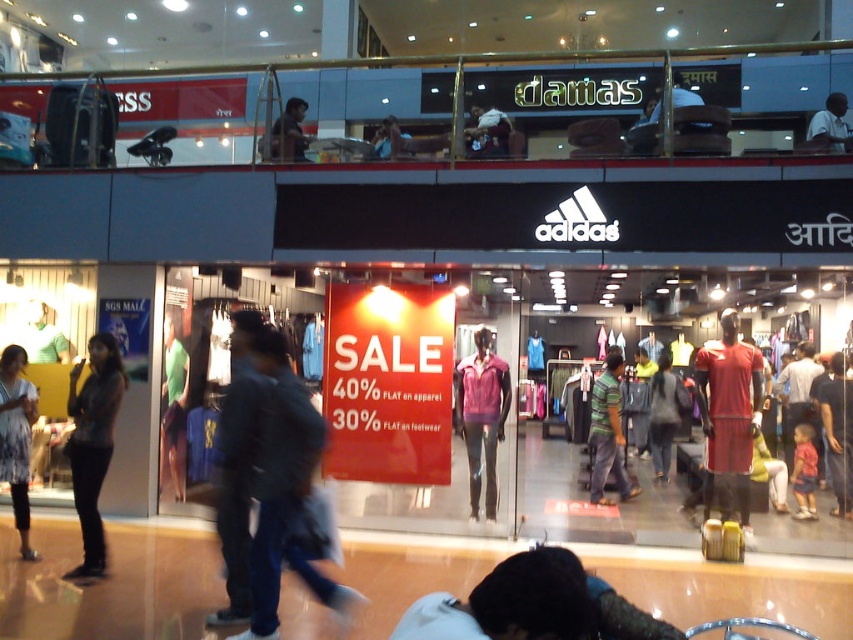
Between point (294, 467) and point (273, 124), which one is positioned behind?

The point (273, 124) is more distant.

Between point (254, 563) and point (306, 106), which one is positioned behind?

The point (306, 106) is behind.

You are a GUI agent. You are given a task and a screenshot of the screen. Output one action in this format:
    pyautogui.click(x=<x>, y=<y>)
    Task: Click on the denim jacket at center
    The width and height of the screenshot is (853, 640).
    Given the screenshot: What is the action you would take?
    pyautogui.click(x=287, y=492)

Can you confirm if pink fabric jacket at center is wider than matte black shirt at upper center?

Yes.

Between point (488, 436) and point (300, 129), which one is positioned in front?

Positioned in front is point (488, 436).

Is point (486, 355) closer to camera compared to point (305, 147)?

Yes, point (486, 355) is closer to viewer.

Locate an element on the screen. pink fabric jacket at center is located at coordinates (482, 417).

Which is more to the left, striped cotton shirt at center or matte black shirt at upper center?

From the viewer's perspective, matte black shirt at upper center appears more on the left side.

Between striped cotton shirt at center and matte black shirt at upper center, which one appears on the right side from the viewer's perspective?

striped cotton shirt at center

Who is more forward, (593, 499) or (294, 129)?

Point (294, 129) is in front.

Locate an element on the screen. The height and width of the screenshot is (640, 853). striped cotton shirt at center is located at coordinates (608, 433).